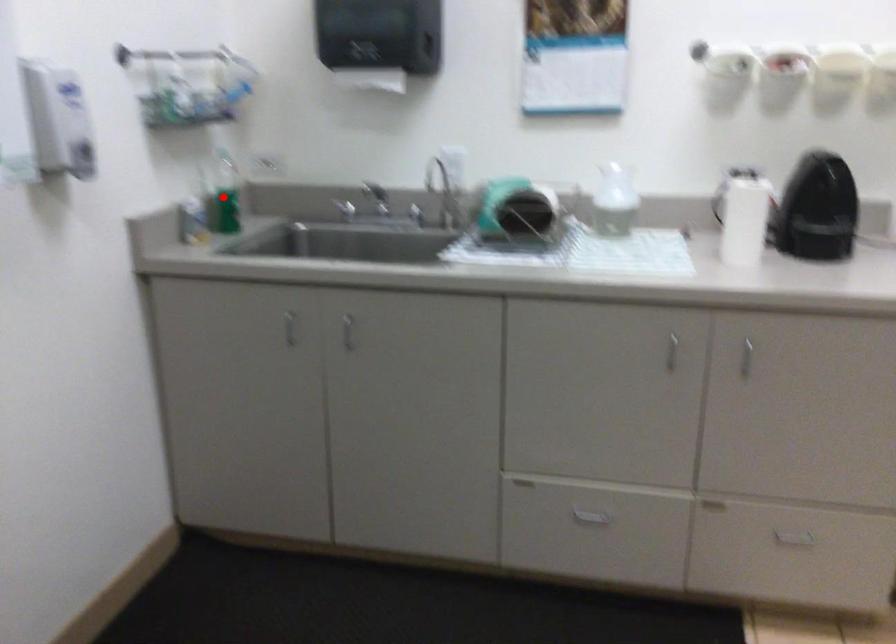
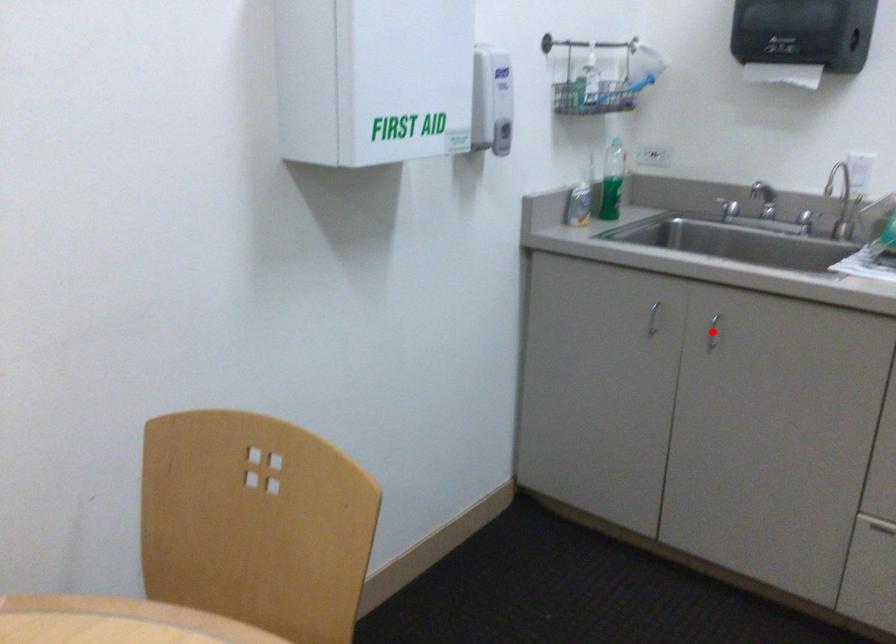
I am providing you with two images of the same scene from different viewpoints. A red point is marked on the first image and another point is marked on the second image. Is the red point in image1 aligned with the point shown in image2?

No